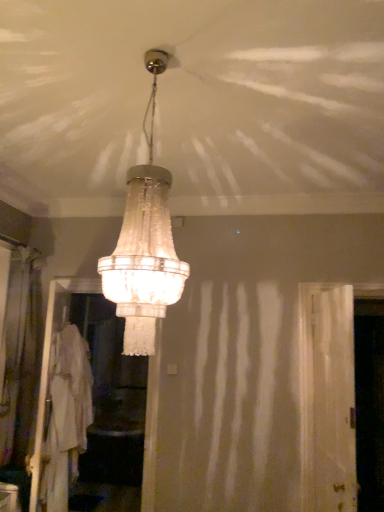
Question: Is point (16, 313) closer or farther from the camera than point (64, 333)?

Choices:
 (A) closer
 (B) farther

Answer: (B)

Question: Relative to white translucent screen door at center, arranged as the second screen door when viewed from the front, is silky beige curtain at left in front or behind?

Choices:
 (A) front
 (B) behind

Answer: (A)

Question: Which is nearer to the white translucent screen door at center, arranged as the second screen door when viewed from the front?

Choices:
 (A) white cotton robe at lower left
 (B) clear plastic screen door at right, which is counted as the third screen door, starting from the left
 (C) silky beige curtain at left
 (D) clear glass chandelier at center
 (E) white translucent screen door at right, marked as the 1th screen door in a front-to-back arrangement

Answer: (C)

Question: Which is nearer to the clear plastic screen door at right, the 3th screen door when ordered from front to back?

Choices:
 (A) white translucent screen door at right, the 2th screen door viewed from the left
 (B) white cotton robe at lower left
 (C) silky beige curtain at left
 (D) clear glass chandelier at center
 (E) white translucent screen door at center, which appears as the second screen door when viewed from the back

Answer: (A)